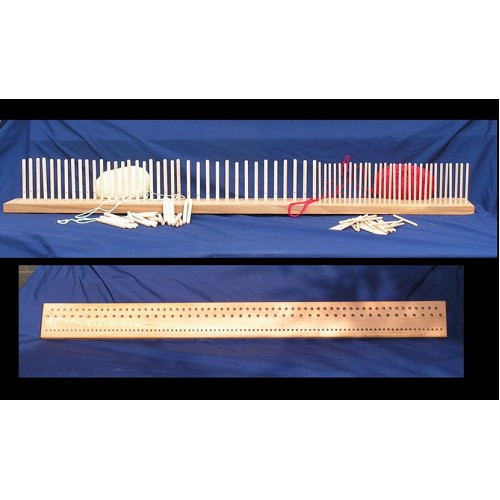
The height and width of the screenshot is (500, 500). I want to click on wood board with pegs, so click(215, 204).